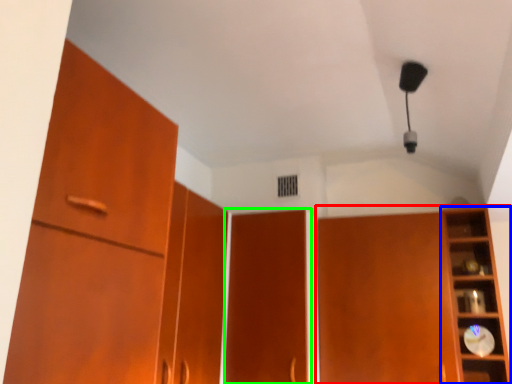
Question: Considering the real-world distances, which object is farthest from cupboard (highlighted by a red box)? shelf (highlighted by a blue box) or door (highlighted by a green box)?

Choices:
 (A) shelf
 (B) door

Answer: (B)